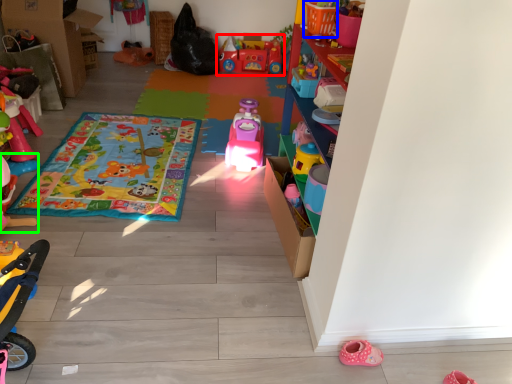
Question: Estimate the real-world distances between objects in this image. Which object is farther from toy (highlighted by a red box), toy (highlighted by a blue box) or toy (highlighted by a green box)?

Choices:
 (A) toy
 (B) toy

Answer: (B)